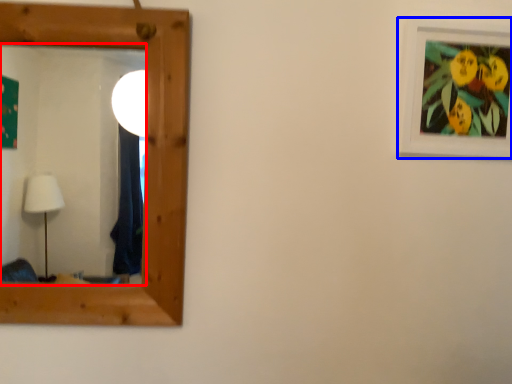
Question: Which object is closer to the camera taking this photo, mirror (highlighted by a red box) or picture frame (highlighted by a blue box)?

Choices:
 (A) mirror
 (B) picture frame

Answer: (A)